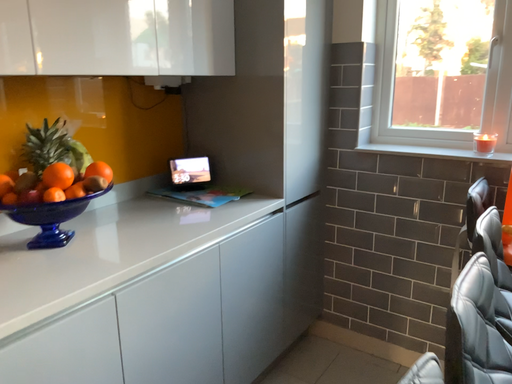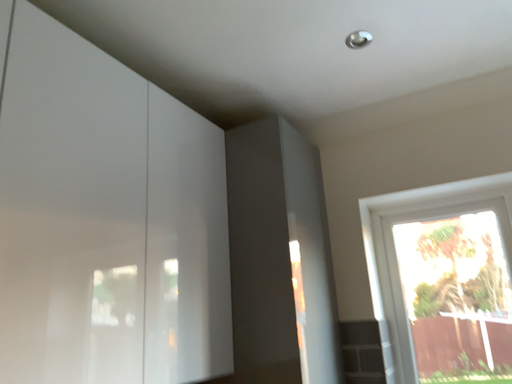
Question: How did the camera likely rotate when shooting the video?

Choices:
 (A) rotated upward
 (B) rotated downward

Answer: (A)